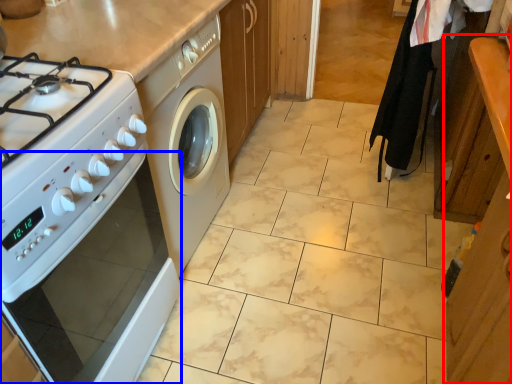
Question: Which object is closer to the camera taking this photo, cabinetry (highlighted by a red box) or oven (highlighted by a blue box)?

Choices:
 (A) cabinetry
 (B) oven

Answer: (A)